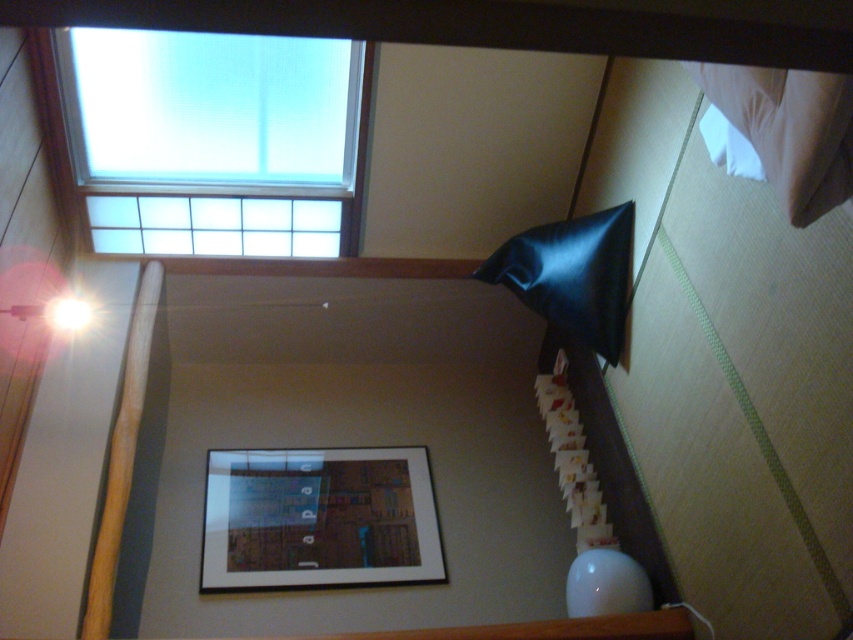
Can you confirm if white soft pillow at upper right is shorter than wooden beam at left?

Yes.

Can you confirm if white soft pillow at upper right is thinner than wooden beam at left?

Correct, white soft pillow at upper right's width is less than wooden beam at left's.

Who is more forward, (782, 100) or (90, 636)?

Point (782, 100)

This screenshot has height=640, width=853. In order to click on white soft pillow at upper right in this screenshot , I will do [788, 129].

Who is positioned more to the right, black leather pillow at upper right or wooden beam at left?

From the viewer's perspective, black leather pillow at upper right appears more on the right side.

Image resolution: width=853 pixels, height=640 pixels. Identify the location of black leather pillow at upper right. (572, 275).

Is point (576, 253) more distant than point (131, 346)?

No, (576, 253) is in front of (131, 346).

I want to click on black leather pillow at upper right, so click(x=572, y=275).

Describe the element at coordinates (216, 140) in the screenshot. I see `transparent glass window at upper left` at that location.

Can you confirm if transparent glass window at upper left is positioned above white paper at center?

Indeed, transparent glass window at upper left is positioned over white paper at center.

Who is more distant from viewer, (x=169, y=54) or (x=554, y=390)?

The point (x=554, y=390) is more distant.

At what (x,y) coordinates should I click in order to perform the action: click on transparent glass window at upper left. Please return your answer as a coordinate pair (x, y). Looking at the image, I should click on (216, 140).